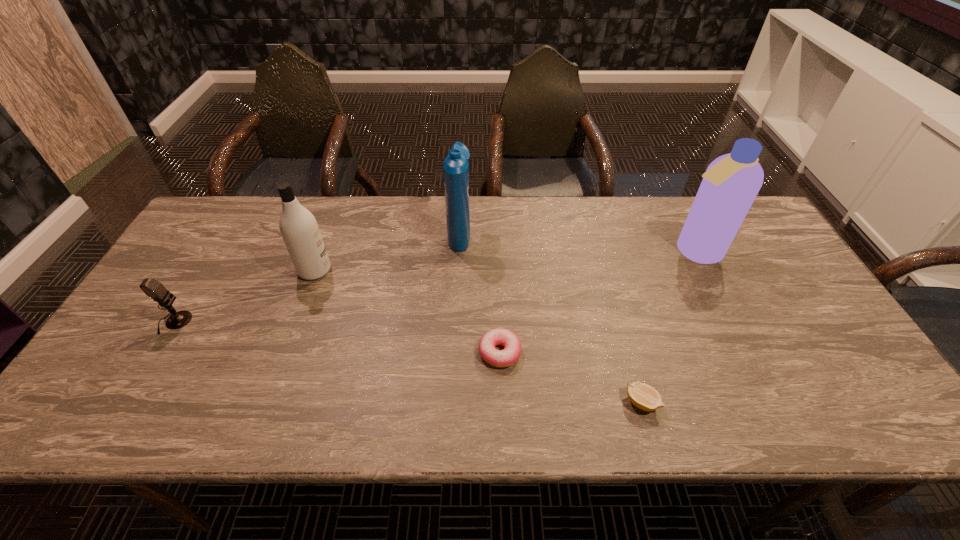
Where is `the fifth closest object to the rightmost shampoo`? This screenshot has height=540, width=960. the fifth closest object to the rightmost shampoo is located at coordinates (151, 287).

What are the coordinates of `object that can be found as the second closest to the second shampoo from right to left` in the screenshot? It's located at (300, 231).

The width and height of the screenshot is (960, 540). Find the location of `shampoo that is the second closest to the fourth object from left to right`. shampoo that is the second closest to the fourth object from left to right is located at coordinates (300, 231).

Identify which shampoo is located as the nearest to the rightmost shampoo. Please provide its 2D coordinates. Your answer should be formatted as a tuple, i.e. [(x, y)], where the tuple contains the x and y coordinates of a point satisfying the conditions above.

[(455, 166)]

Find the location of a particular element. This screenshot has height=540, width=960. vacant position in the image that satisfies the following two spatial constraints: 1. on the front-facing side of the leftmost shampoo; 2. on the left side of the fourth object from left to right is located at coordinates (285, 352).

This screenshot has height=540, width=960. I want to click on vacant region that satisfies the following two spatial constraints: 1. on the front-facing side of the microphone; 2. on the back side of the third object from right to left, so click(156, 352).

Locate an element on the screen. This screenshot has width=960, height=540. free space that satisfies the following two spatial constraints: 1. on the back side of the third object from right to left; 2. on the front-facing side of the leftmost shampoo is located at coordinates (496, 270).

Find the location of `blank area in the image that satisfies the following two spatial constraints: 1. on the front-facing side of the leftmost shampoo; 2. on the left side of the doughnut`. blank area in the image that satisfies the following two spatial constraints: 1. on the front-facing side of the leftmost shampoo; 2. on the left side of the doughnut is located at coordinates (285, 352).

This screenshot has height=540, width=960. What are the coordinates of `vacant space that satisfies the following two spatial constraints: 1. on the front-facing side of the leftmost object; 2. on the back side of the fifth object from left to right` in the screenshot? It's located at (126, 403).